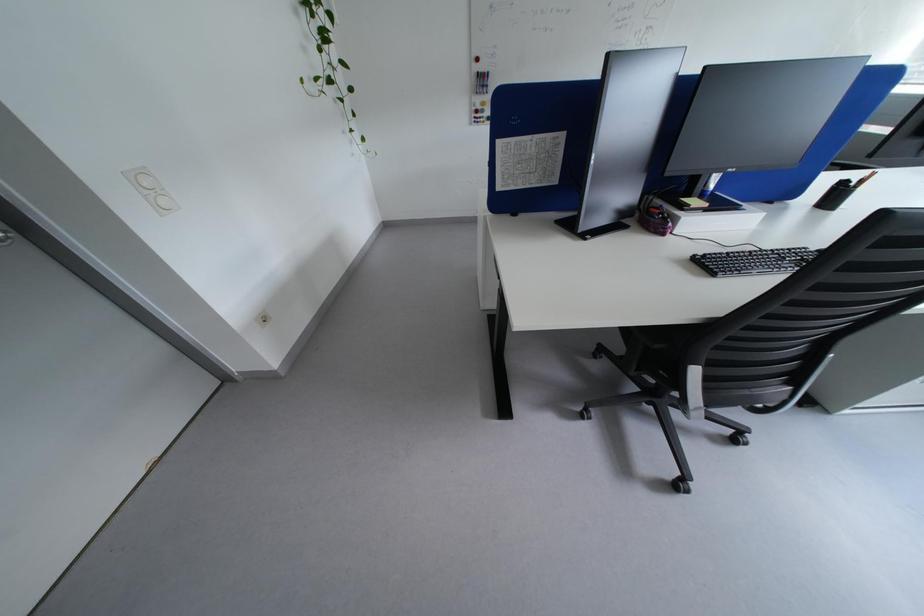
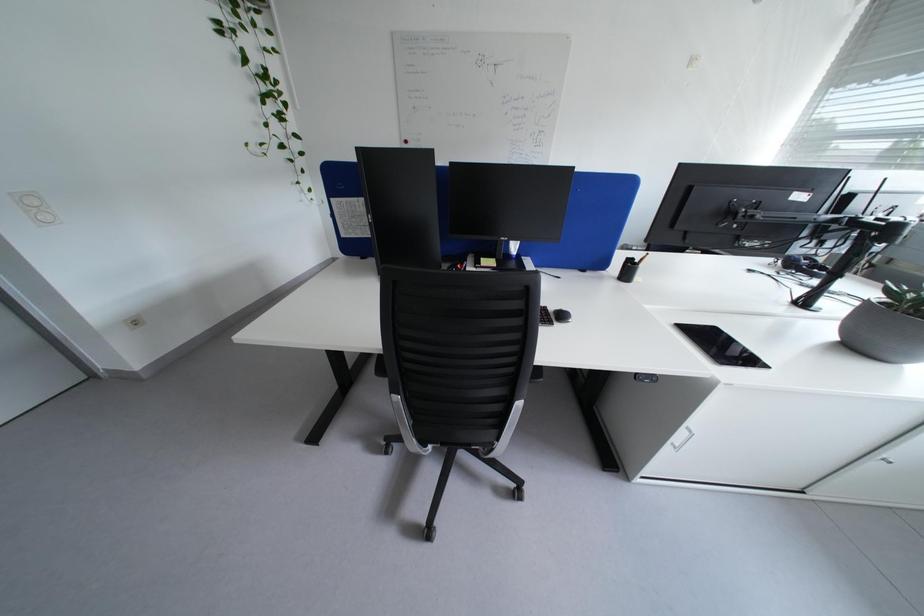
Question: Which direction would the cameraman need to move to produce the second image? Reply with the corresponding letter.

Choices:
 (A) Left
 (B) Right
 (C) Forward
 (D) Backward

Answer: (B)